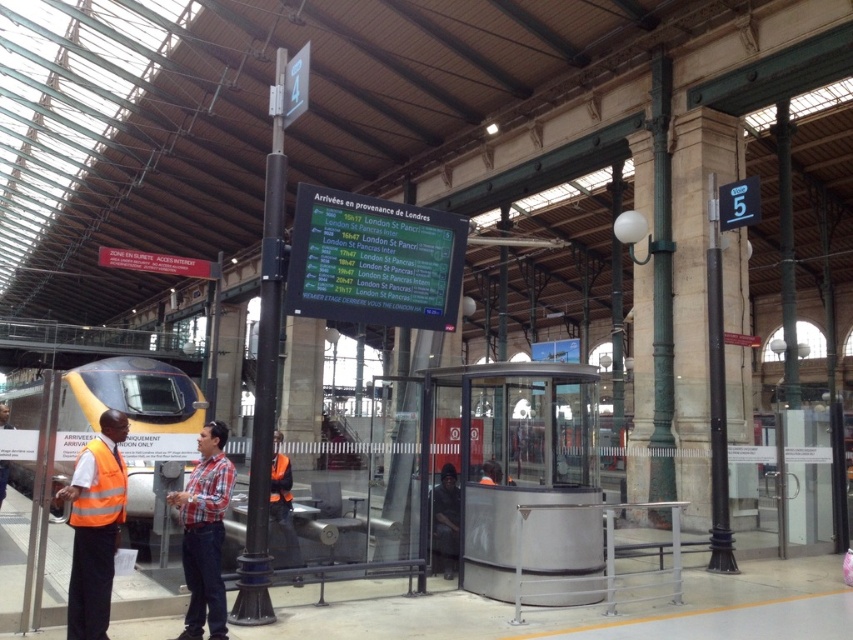
Question: Which object is the farthest from the high visibility vest at left?

Choices:
 (A) yellow-orange metallic train at left
 (B) dark blue uniform at center
 (C) high visibility orange safety vest at lower left
 (D) plaid shirt at center

Answer: (A)

Question: Which point is farther from the camera taking this photo?

Choices:
 (A) (78, 632)
 (B) (451, 545)
 (C) (68, 460)

Answer: (B)

Question: Can you confirm if high visibility vest at left is wider than dark blue uniform at center?

Choices:
 (A) no
 (B) yes

Answer: (B)

Question: Considering the relative positions of high visibility vest at left and dark blue uniform at center in the image provided, where is high visibility vest at left located with respect to dark blue uniform at center?

Choices:
 (A) right
 (B) left

Answer: (B)

Question: Is plaid shirt at center bigger than high visibility orange safety vest at lower left?

Choices:
 (A) yes
 (B) no

Answer: (A)

Question: Which point is farther to the camera?

Choices:
 (A) (107, 541)
 (B) (115, 500)

Answer: (B)